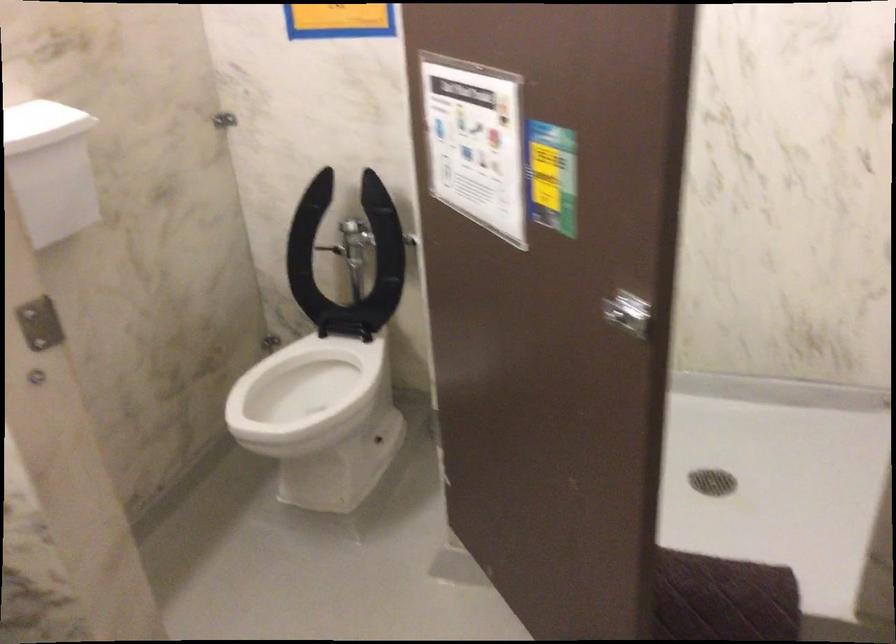
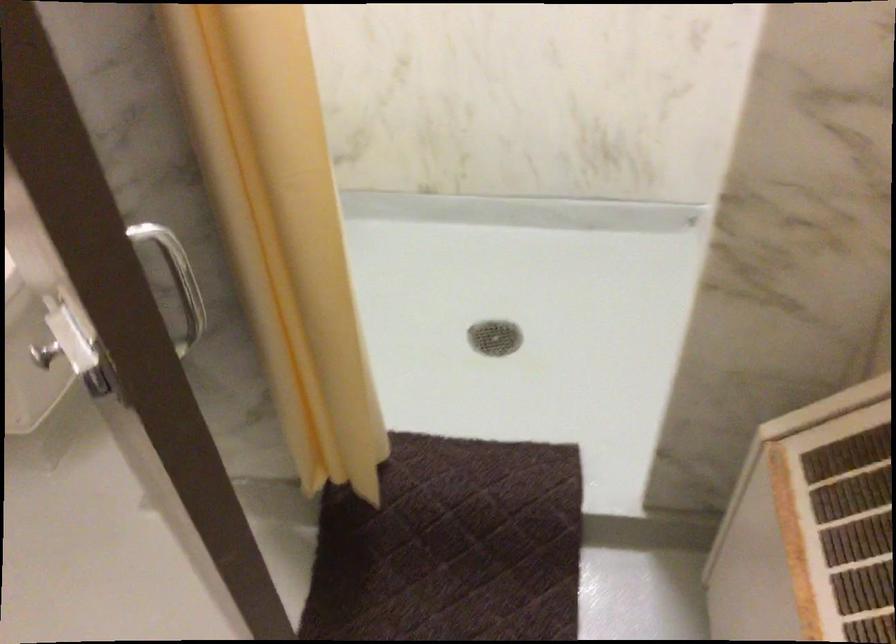
Question: The images are taken continuously from a first-person perspective. In which direction is your viewpoint rotating?

Choices:
 (A) Left
 (B) Right
 (C) Up
 (D) Down

Answer: (D)